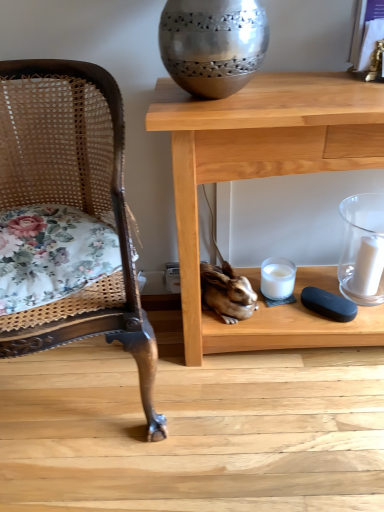
Question: Is white glass candle at lower center, which ranks as the 2th candle holder in right-to-left order, to the left or to the right of wooden table at center in the image?

Choices:
 (A) left
 (B) right

Answer: (A)

Question: From the image's perspective, is white glass candle at lower center, which ranks as the 2th candle holder in right-to-left order, above or below wooden table at center?

Choices:
 (A) above
 (B) below

Answer: (B)

Question: Based on their relative distances, which object is nearer to the woven cane chair at left?

Choices:
 (A) white glass candle at lower center, which ranks as the 2th candle holder in right-to-left order
 (B) white matte candle at right
 (C) wooden table at center
 (D) clear glass candle at right, marked as the 2th candle holder in a left-to-right arrangement

Answer: (C)

Question: Estimate the real-world distances between objects in this image. Which object is closer to the wooden table at center?

Choices:
 (A) white glass candle at lower center, marked as the first candle holder in a left-to-right arrangement
 (B) white matte candle at right
 (C) woven cane chair at left
 (D) clear glass candle at right, acting as the 1th candle holder starting from the right

Answer: (C)